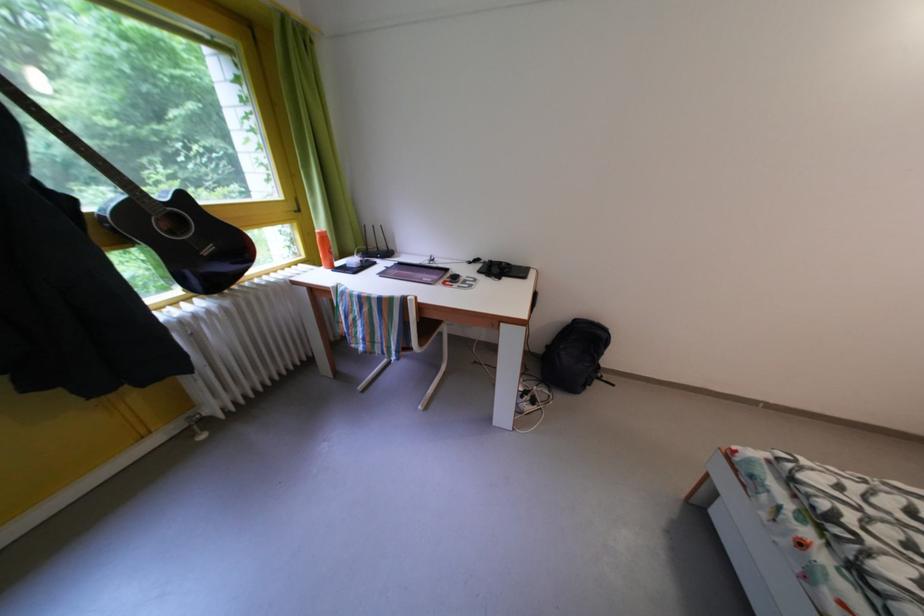
The location [575,355] corresponds to which object?

It corresponds to the black backpack in the image.